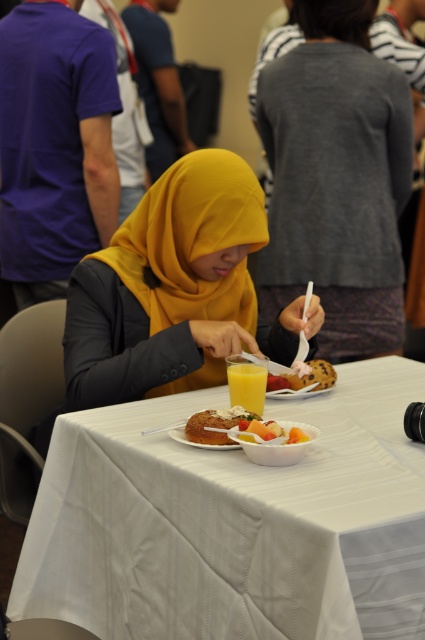
Question: Considering the real-world distances, which object is farthest from the translucent yellow liquid at table center?

Choices:
 (A) yellow matte hijab at center
 (B) golden brown bread at center

Answer: (A)

Question: Can you confirm if yellow matte hijab at center is wider than golden brown bread at center?

Choices:
 (A) yes
 (B) no

Answer: (A)

Question: Considering the real-world distances, which object is farthest from the translucent yellow liquid at table center?

Choices:
 (A) smooth white bowl at center
 (B) golden brown bread at center
 (C) yellow matte hijab at center

Answer: (C)

Question: Which of the following is the farthest from the observer?

Choices:
 (A) (74, 285)
 (B) (209, 417)
 (C) (305, 433)

Answer: (A)

Question: Does white fabric table at center come in front of smooth white bowl at center?

Choices:
 (A) no
 (B) yes

Answer: (B)

Question: Observing the image, what is the correct spatial positioning of yellow matte hijab at center in reference to translucent yellow liquid at table center?

Choices:
 (A) below
 (B) above

Answer: (B)